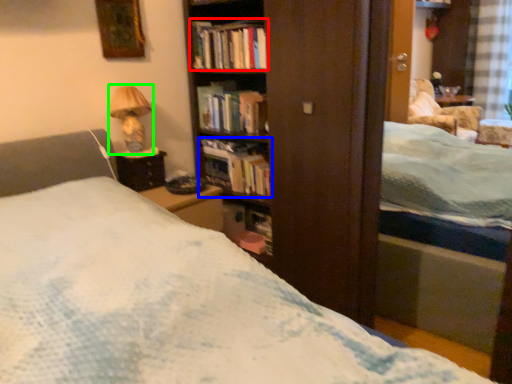
Question: Which is nearer to the book (highlighted by a red box)? book (highlighted by a blue box) or table lamp (highlighted by a green box).

Choices:
 (A) book
 (B) table lamp

Answer: (B)